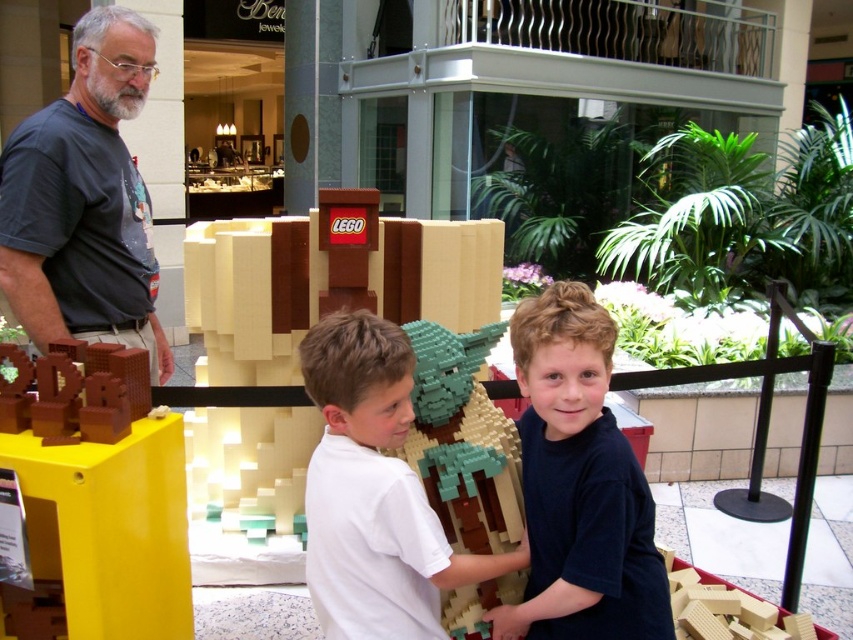
Does matte brown blocks at left have a greater width compared to dark blue shirt at center?

Yes, matte brown blocks at left is wider than dark blue shirt at center.

Is the position of matte brown blocks at left more distant than that of dark blue shirt at center?

Yes, matte brown blocks at left is behind dark blue shirt at center.

Identify the location of matte brown blocks at left. Image resolution: width=853 pixels, height=640 pixels. (91, 499).

Find the location of a particular element. matte brown blocks at left is located at coordinates (91, 499).

Looking at this image, is dark blue shirt at center to the right of white matte shirt at center from the viewer's perspective?

Yes, dark blue shirt at center is to the right of white matte shirt at center.

Does dark blue shirt at center appear under white matte shirt at center?

Actually, dark blue shirt at center is above white matte shirt at center.

What are the coordinates of `dark blue shirt at center` in the screenshot? It's located at (579, 484).

Is brown matte lego structure at center above dark blue shirt at center?

Yes.

What do you see at coordinates (323, 285) in the screenshot? This screenshot has width=853, height=640. I see `brown matte lego structure at center` at bounding box center [323, 285].

Image resolution: width=853 pixels, height=640 pixels. Describe the element at coordinates (323, 285) in the screenshot. I see `brown matte lego structure at center` at that location.

Identify the location of brown matte lego structure at center. (323, 285).